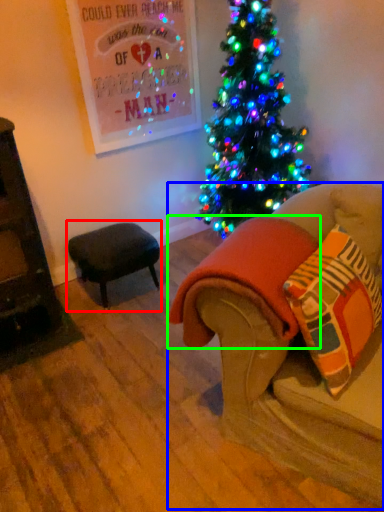
Question: Which object is the farthest from table (highlighted by a red box)? Choose among these: studio couch (highlighted by a blue box) or blanket (highlighted by a green box).

Choices:
 (A) studio couch
 (B) blanket

Answer: (A)